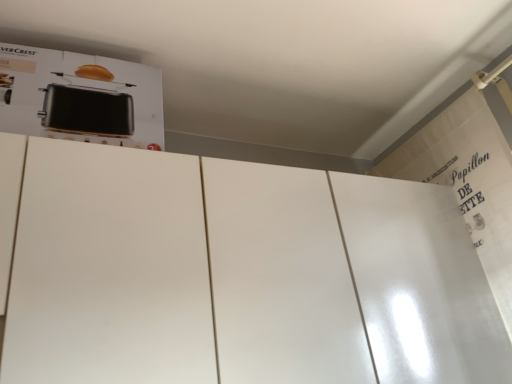
The width and height of the screenshot is (512, 384). What do you see at coordinates (420, 283) in the screenshot?
I see `white glossy door at upper right` at bounding box center [420, 283].

Image resolution: width=512 pixels, height=384 pixels. I want to click on white glossy door at upper right, so click(420, 283).

Find the location of a particular element. This screenshot has width=512, height=384. black metallic toaster at upper left is located at coordinates (80, 97).

In order to face black metallic toaster at upper left, should I rotate leftwards or rightwards?

A 22.574 degree turn to the left will do.

The image size is (512, 384). What do you see at coordinates (80, 97) in the screenshot? I see `black metallic toaster at upper left` at bounding box center [80, 97].

Image resolution: width=512 pixels, height=384 pixels. Identify the location of white glossy door at upper right. (420, 283).

Consider the image. Considering the positions of objects black metallic toaster at upper left and white glossy door at upper right in the image provided, who is more to the left, black metallic toaster at upper left or white glossy door at upper right?

black metallic toaster at upper left is more to the left.

In the image, is black metallic toaster at upper left positioned in front of or behind white glossy door at upper right?

black metallic toaster at upper left is in front of white glossy door at upper right.

Is point (94, 114) closer to camera compared to point (426, 326)?

Yes, it is.

From the image's perspective, who appears lower, black metallic toaster at upper left or white glossy door at upper right?

white glossy door at upper right is shown below in the image.

From a real-world perspective, is black metallic toaster at upper left on white glossy door at upper right?

Yes.

Which object is thinner, black metallic toaster at upper left or white glossy door at upper right?

white glossy door at upper right.

Is black metallic toaster at upper left shorter than white glossy door at upper right?

Yes, black metallic toaster at upper left is shorter than white glossy door at upper right.

Which of these two, black metallic toaster at upper left or white glossy door at upper right, is bigger?

white glossy door at upper right is bigger.

Could white glossy door at upper right be considered to be inside black metallic toaster at upper left?

No, black metallic toaster at upper left does not contain white glossy door at upper right.

Is the surface of black metallic toaster at upper left in direct contact with white glossy door at upper right?

They are not placed beside each other.

Is black metallic toaster at upper left oriented towards white glossy door at upper right?

No, black metallic toaster at upper left is not oriented towards white glossy door at upper right.

How many degrees apart are the facing directions of black metallic toaster at upper left and white glossy door at upper right?

The angle between the facing direction of black metallic toaster at upper left and the facing direction of white glossy door at upper right is 88.6 degrees.

Measure the distance from black metallic toaster at upper left to white glossy door at upper right.

black metallic toaster at upper left is 23.77 inches away from white glossy door at upper right.

You are a GUI agent. You are given a task and a screenshot of the screen. Output one action in this format:
    pyautogui.click(x=<x>, y=<y>)
    Task: Click on the appliance above the white glossy door at upper right (from a real-world perspective)
    The width and height of the screenshot is (512, 384).
    Given the screenshot: What is the action you would take?
    pyautogui.click(x=80, y=97)

Between white glossy door at upper right and black metallic toaster at upper left, which one appears on the right side from the viewer's perspective?

From the viewer's perspective, white glossy door at upper right appears more on the right side.

Is white glossy door at upper right in front of or behind black metallic toaster at upper left in the image?

white glossy door at upper right is behind black metallic toaster at upper left.

Which point is more forward, (437, 272) or (13, 67)?

Positioned in front is point (13, 67).

In the scene shown: From the image's perspective, is white glossy door at upper right under black metallic toaster at upper left?

Correct, white glossy door at upper right appears lower than black metallic toaster at upper left in the image.

From a real-world perspective, is white glossy door at upper right below black metallic toaster at upper left?

Yes, from a real-world perspective, white glossy door at upper right is beneath black metallic toaster at upper left.

Does white glossy door at upper right have a lesser width compared to black metallic toaster at upper left?

Correct, the width of white glossy door at upper right is less than that of black metallic toaster at upper left.

Consider the image. Between white glossy door at upper right and black metallic toaster at upper left, which one has more height?

white glossy door at upper right.

From the picture: Is white glossy door at upper right smaller than black metallic toaster at upper left?

Incorrect, white glossy door at upper right is not smaller in size than black metallic toaster at upper left.

Is white glossy door at upper right spatially inside black metallic toaster at upper left, or outside of it?

white glossy door at upper right is outside black metallic toaster at upper left.

Is white glossy door at upper right beside black metallic toaster at upper left?

No, white glossy door at upper right is not touching black metallic toaster at upper left.

Is white glossy door at upper right oriented away from black metallic toaster at upper left?

That's not correct — white glossy door at upper right is not looking away from black metallic toaster at upper left.

How different are the orientations of white glossy door at upper right and black metallic toaster at upper left in degrees?

There is a 88.6-degree angle between the facing directions of white glossy door at upper right and black metallic toaster at upper left.

The image size is (512, 384). I want to click on appliance in front of the white glossy door at upper right, so click(80, 97).

Identify the location of appliance above the white glossy door at upper right (from the image's perspective). (80, 97).

The width and height of the screenshot is (512, 384). Identify the location of door that appears on the right of black metallic toaster at upper left. (420, 283).